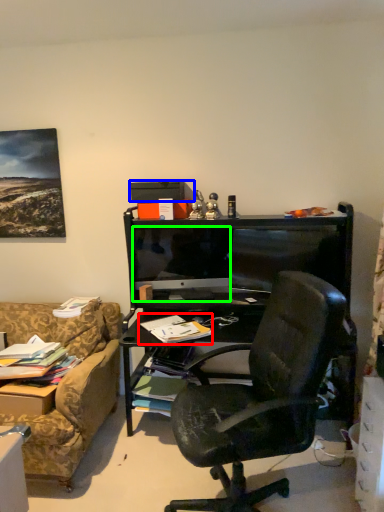
Question: Considering the real-world distances, which object is farthest from book (highlighted by a red box)? box (highlighted by a blue box) or television (highlighted by a green box)?

Choices:
 (A) box
 (B) television

Answer: (A)